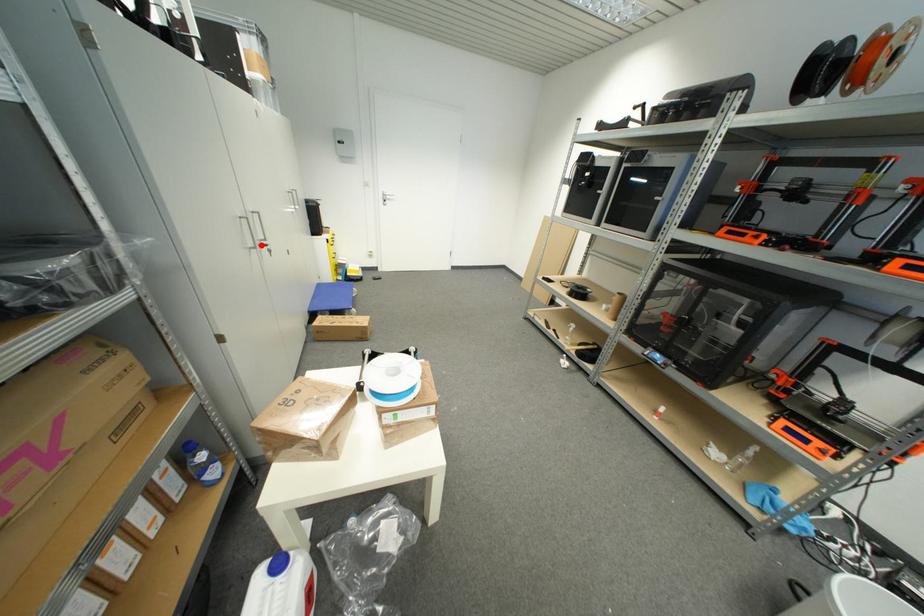
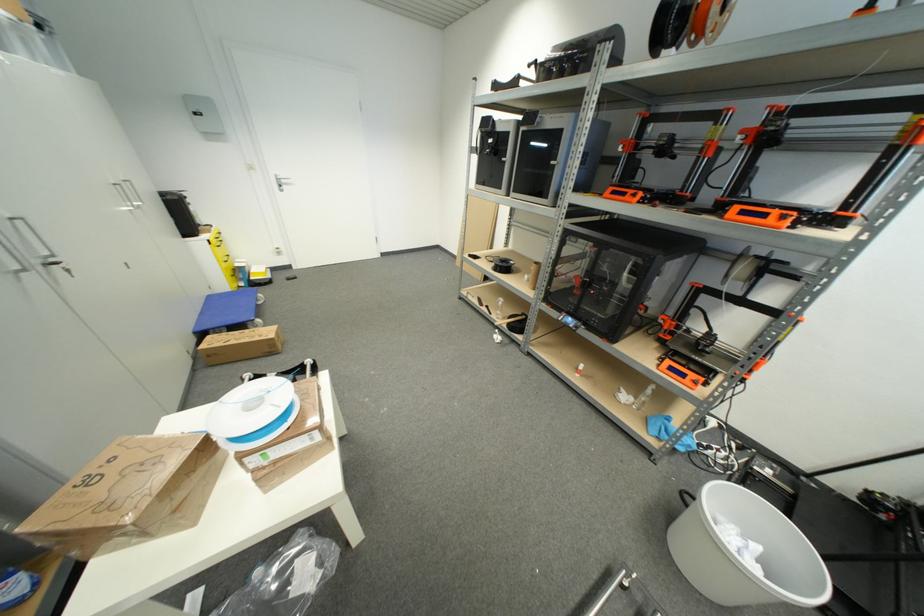
Find the pixel in the second image that matches the highlighted location in the first image.

(43, 264)